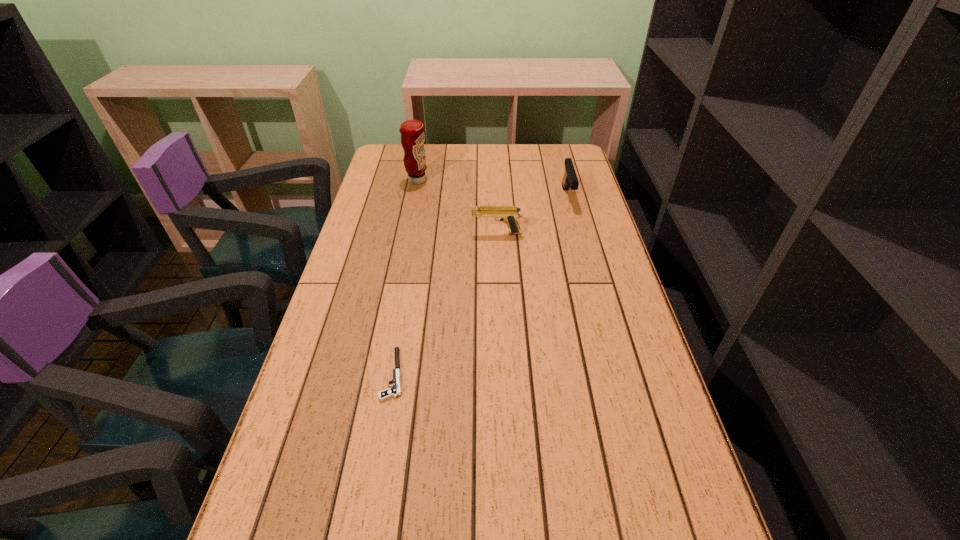
In order to click on the tallest object in this screenshot , I will do `click(412, 131)`.

You are a GUI agent. You are given a task and a screenshot of the screen. Output one action in this format:
    pyautogui.click(x=<x>, y=<y>)
    Task: Click on the rightmost object
    The height and width of the screenshot is (540, 960).
    Given the screenshot: What is the action you would take?
    coord(570,180)

Locate an element on the screen. This screenshot has width=960, height=540. the rightmost pistol is located at coordinates (570, 180).

Locate an element on the screen. The width and height of the screenshot is (960, 540). the second object from right to left is located at coordinates (509, 214).

The width and height of the screenshot is (960, 540). I want to click on the second pistol from right to left, so click(509, 214).

Where is `the leftmost pistol`? The width and height of the screenshot is (960, 540). the leftmost pistol is located at coordinates (395, 391).

This screenshot has width=960, height=540. I want to click on the nearest pistol, so click(395, 391).

Find the location of a particular element. Image resolution: width=960 pixels, height=540 pixels. free spot located on the front of the condiment is located at coordinates (407, 233).

Identify the location of vacant space located 0.090m on the front-facing side of the farthest pistol. The height and width of the screenshot is (540, 960). (575, 228).

The image size is (960, 540). I want to click on vacant space located at the barrel of the second farthest pistol, so click(407, 233).